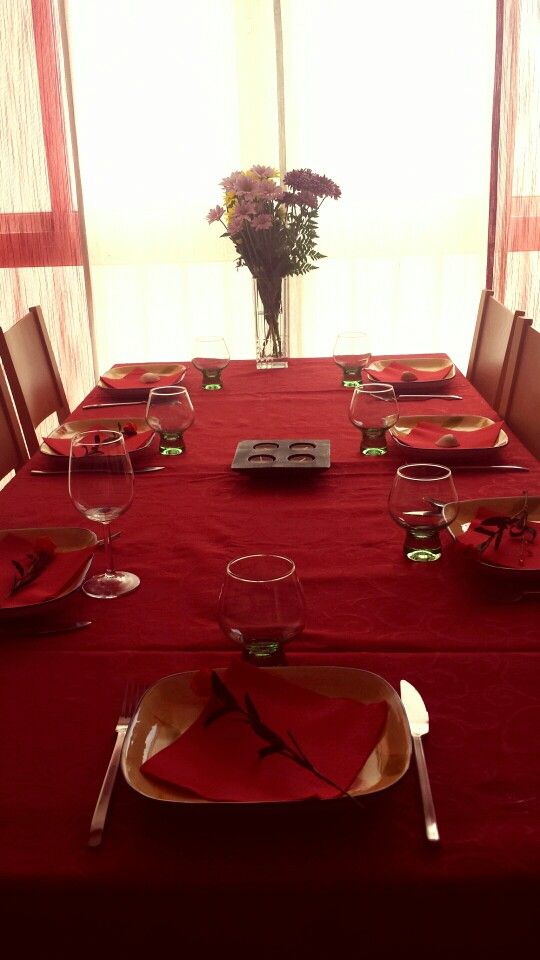
The image size is (540, 960). Find the location of `plates`. plates is located at coordinates (152, 793), (76, 583), (467, 515), (457, 421), (416, 361), (126, 367), (127, 422).